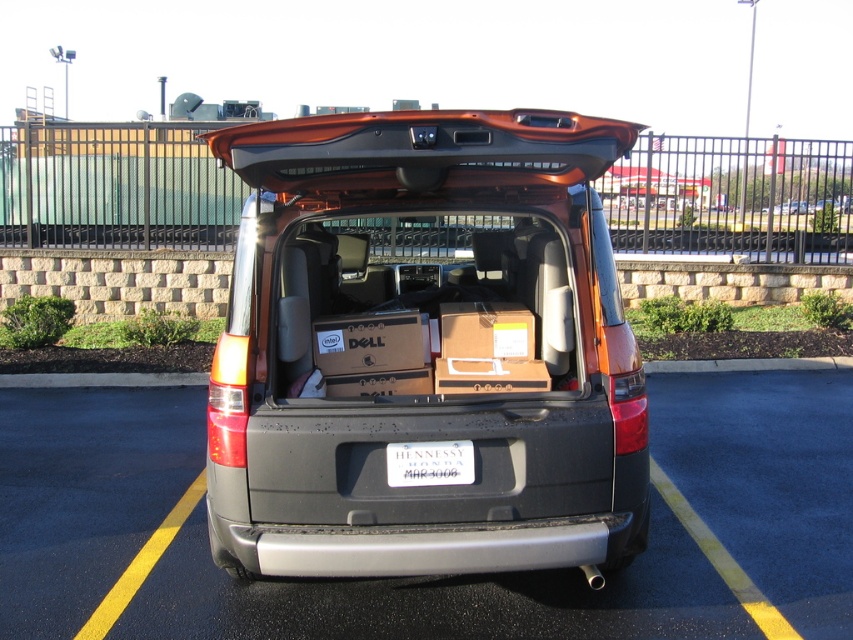
You are a delivery driver who needs to load a tall package into the trunk of the metallic orange suv at center. The package is 1.2 meters tall. Can you fit the package vertically into the trunk if the white plastic license plate at center is only 0.3 meters tall?

The metallic orange suv at center is taller than the white plastic license plate at center. Since the license plate is 0.3 meters tall, the SUV must be taller than that. However, without knowing the exact height of the SUV, we can only confirm it is taller than 0.3 meters but cannot determine if it can accommodate the 1.2 meter package. Further measurements are needed.

You are a delivery driver who needs to park your truck in the parking lot. You see the metallic orange suv at center and the black plastic car at center. Which vehicle should you avoid parking next to if you want to leave enough space for your truck?

You should avoid parking next to the metallic orange suv at center because it is bigger than the black plastic car at center, so leaving space next to it would require more room for your truck.